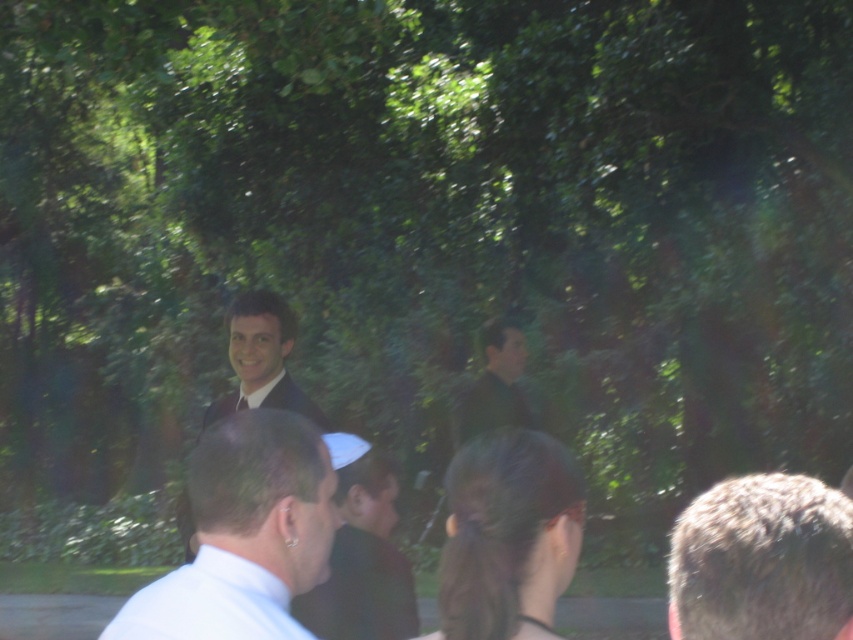
You are at a social event in a park and see two people at the center of the scene. The first person is wearing a shiny black suit at center, and the second is wearing a dark green fabric shirt at center. From your perspective, which one is positioned to the left?

The shiny black suit at center is to the left of the dark green fabric shirt at center.

You are at a park event and want to take a photo of the dark green fabric shirt at center without the blonde hair at right blocking it. What should you do?

Move to the left side so that the blonde hair at right is no longer in front of the dark green fabric shirt at center.

You are a photographer trying to adjust the focus of your camera to capture both the blonde hair at right and the dark green fabric shirt at center. Which object should you focus on first if you want to ensure the taller one is sharp?

The blonde hair at right is taller than the dark green fabric shirt at center, so you should focus on the blonde hair at right first to ensure it is sharp.